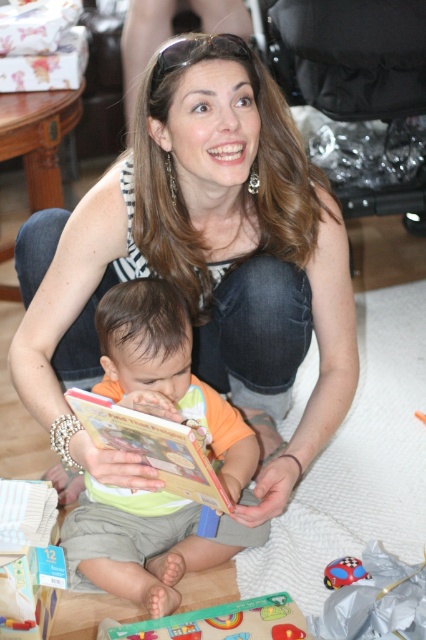
The woman is holding a hardcover book at center and a green matte puzzle piece at lower center. Which object is positioned to the right side?

The green matte puzzle piece at lower center is positioned to the right of the hardcover book at center.

You are a photographer taking a picture of the scene. The green cotton bib at center and the hardcover book at center are both in the frame. Which item is positioned lower in the image?

The green cotton bib at center is positioned below the hardcover book at center, so it is lower in the image.

You are a parent trying to choose between placing the hardcover book at center and the green matte puzzle piece at lower center into a small gift box that can only hold items up to the size of the smaller object. Which item should you avoid placing in the box?

The hardcover book at center is larger than the green matte puzzle piece at lower center, so you should avoid placing the hardcover book at center in the box.